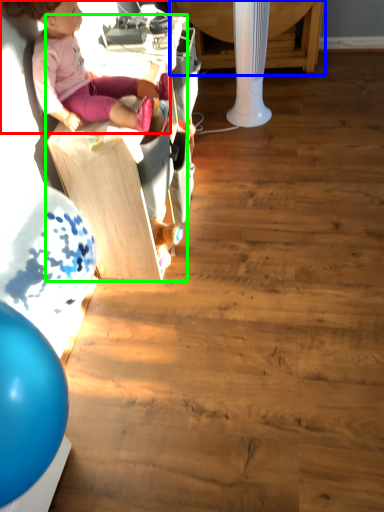
Question: Estimate the real-world distances between objects in this image. Which object is closer to person (highlighted by a red box), table (highlighted by a blue box) or furniture (highlighted by a green box)?

Choices:
 (A) table
 (B) furniture

Answer: (B)